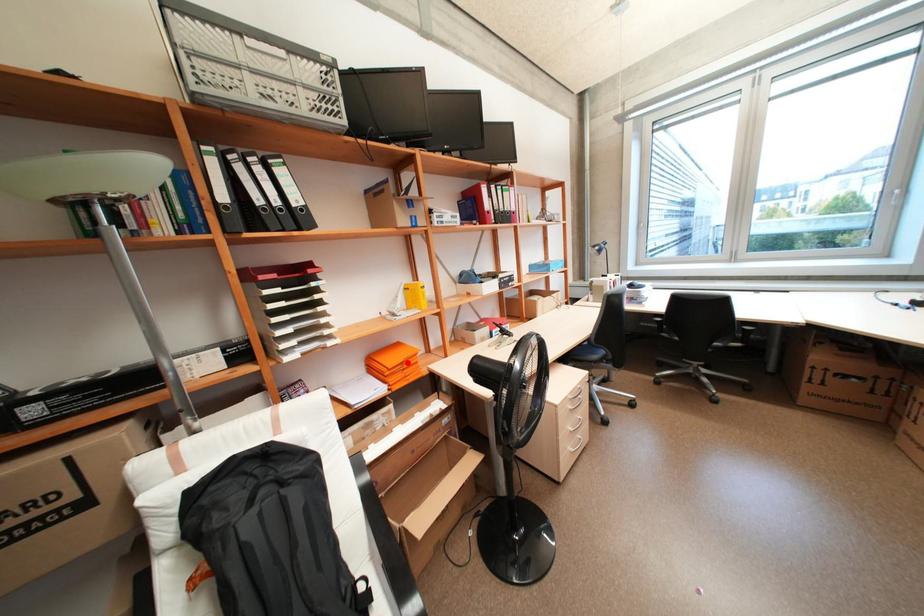
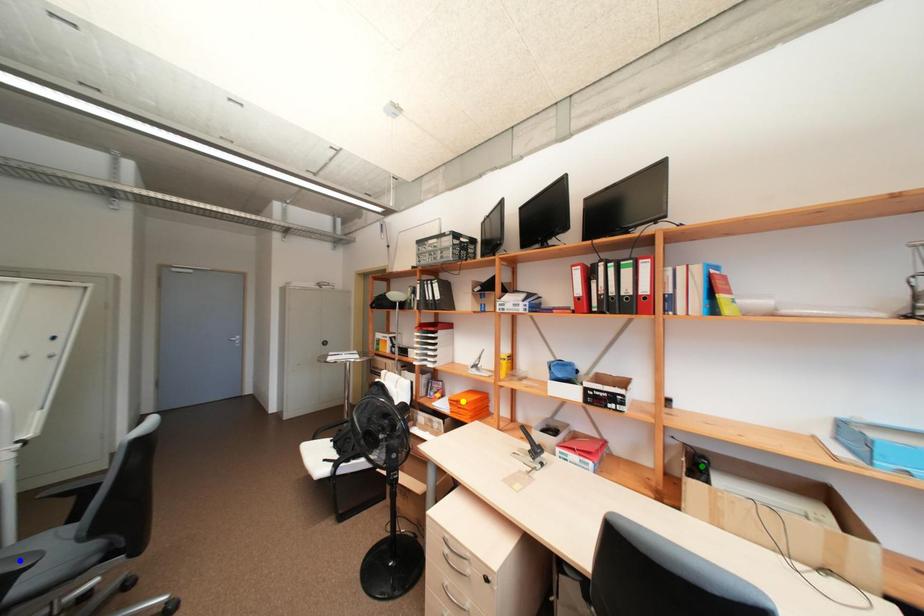
Question: I am providing you with two images of the same scene from different viewpoints. A red point is marked on the first image. You are given multiple points on the second image. In image 2, which mark is for the same physical point as the one in image 1?

Choices:
 (A) blue point
 (B) yellow point
 (C) green point

Answer: (B)